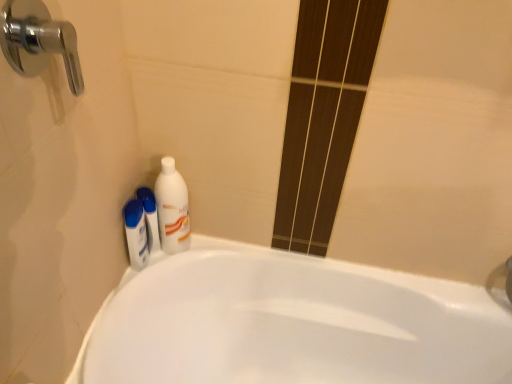
Question: From a real-world perspective, relative to white glossy bottle at lower left, placed as the 2th mouthwash when sorted from left to right, is chrome metallic faucet at upper left vertically above or below?

Choices:
 (A) above
 (B) below

Answer: (A)

Question: In terms of size, does chrome metallic faucet at upper left appear bigger or smaller than white glossy bottle at lower left, placed as the 2th mouthwash when sorted from left to right?

Choices:
 (A) big
 (B) small

Answer: (A)

Question: Considering the real-world distances, which object is farthest from the white glossy bottle at upper left?

Choices:
 (A) chrome metallic faucet at upper left
 (B) white glossy bathtub at lower left
 (C) white glossy mouthwash at lower left, marked as the 2th mouthwash in a right-to-left arrangement
 (D) white glossy bottle at lower left, placed as the 2th mouthwash when sorted from left to right

Answer: (A)

Question: Considering the real-world distances, which object is closest to the white glossy mouthwash at lower left, marked as the first mouthwash in a left-to-right arrangement?

Choices:
 (A) white glossy bathtub at lower left
 (B) chrome metallic faucet at upper left
 (C) white glossy bottle at upper left
 (D) white glossy bottle at lower left, the 1th mouthwash from the right

Answer: (D)